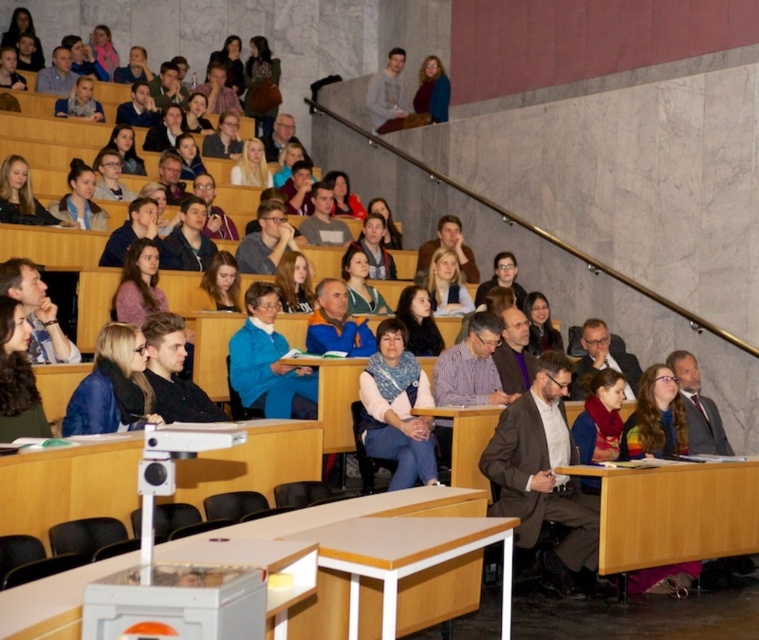
Question: Is knitted scarf at center behind matte blue sweater at center?

Choices:
 (A) no
 (B) yes

Answer: (A)

Question: Which of the following is the closest to the observer?

Choices:
 (A) matte blue sweater at center
 (B) knitted scarf at center
 (C) blue fabric jacket at center

Answer: (C)

Question: In this image, where is blue fabric sweater at center located relative to matte blue sweater at center?

Choices:
 (A) above
 (B) below

Answer: (B)

Question: Can you confirm if knitted scarf at center is bigger than blue fabric jacket at center?

Choices:
 (A) no
 (B) yes

Answer: (B)

Question: Which point is farther from the camera taking this photo?

Choices:
 (A) (411, 390)
 (B) (83, 429)
 (C) (257, 397)
 (D) (480, 291)

Answer: (D)

Question: Which point is closer to the camera?

Choices:
 (A) knitted scarf at center
 (B) blue fabric sweater at center

Answer: (A)